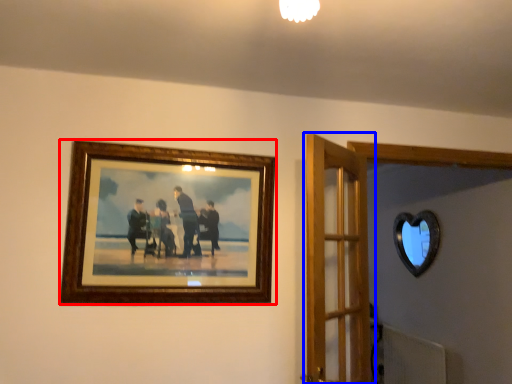
Question: Which of the following is the farthest to the observer, picture frame (highlighted by a red box) or door (highlighted by a blue box)?

Choices:
 (A) picture frame
 (B) door

Answer: (A)